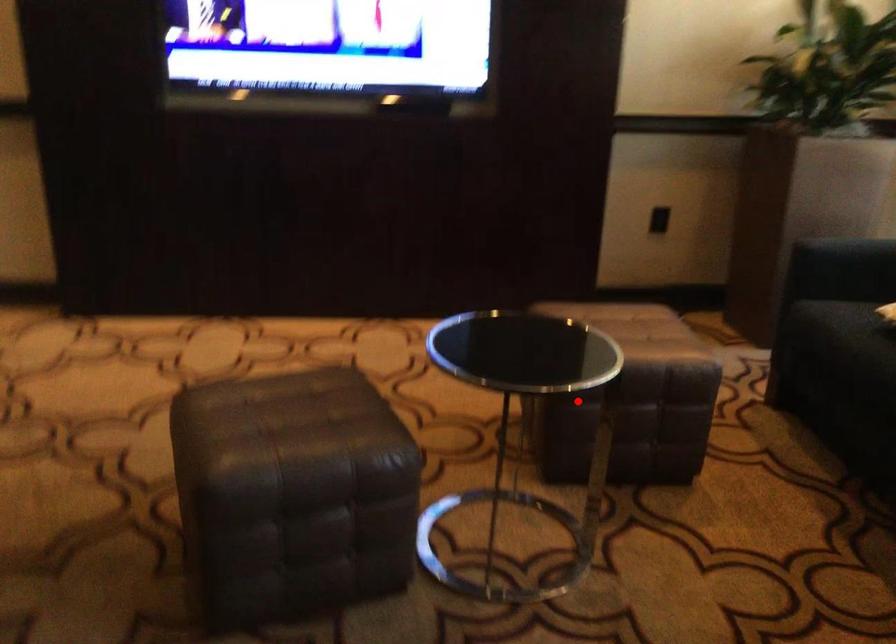
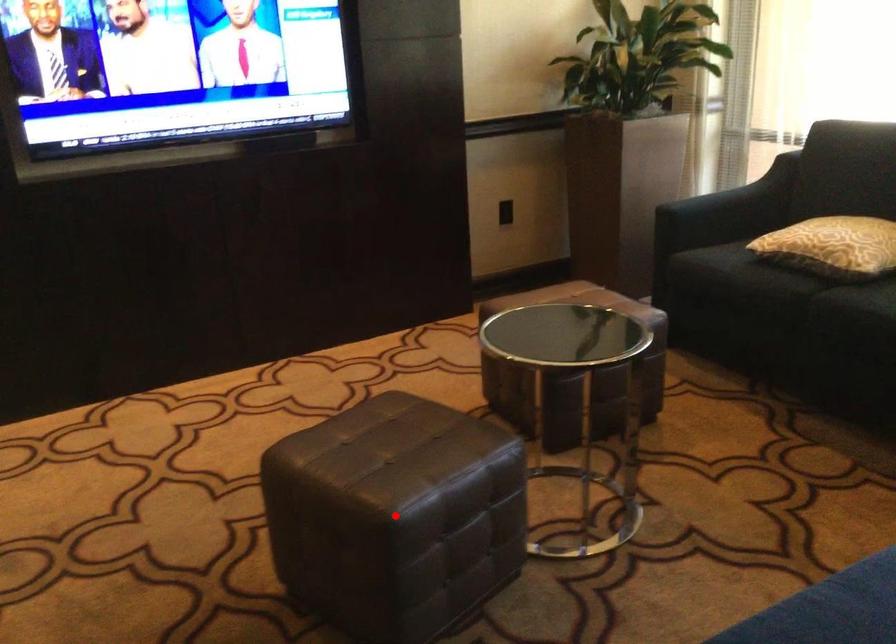
I am providing you with two images of the same scene from different viewpoints. A red point is marked on the first image and another point is marked on the second image. Is the marked point in image1 the same physical position as the marked point in image2?

No